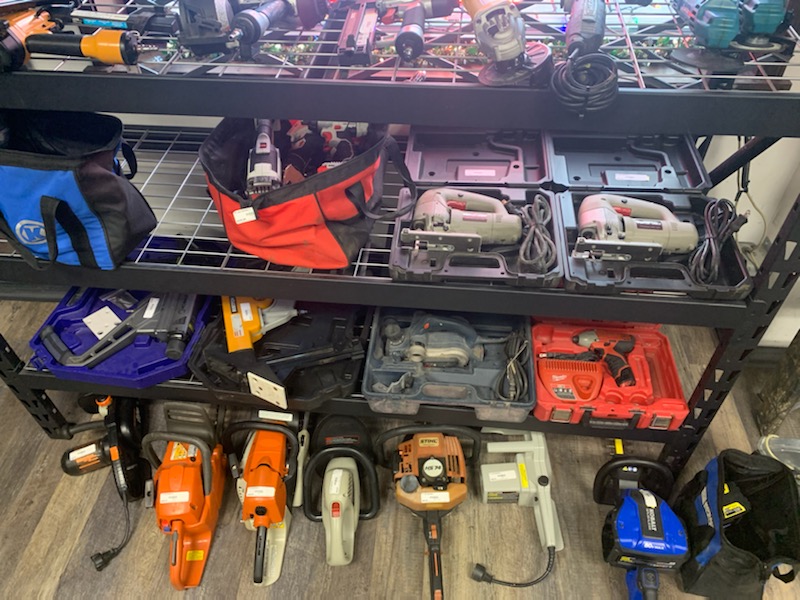
This screenshot has height=600, width=800. I want to click on shelf bottomshelf legs, so click(x=320, y=53), click(x=226, y=255), click(x=700, y=415), click(x=38, y=411).